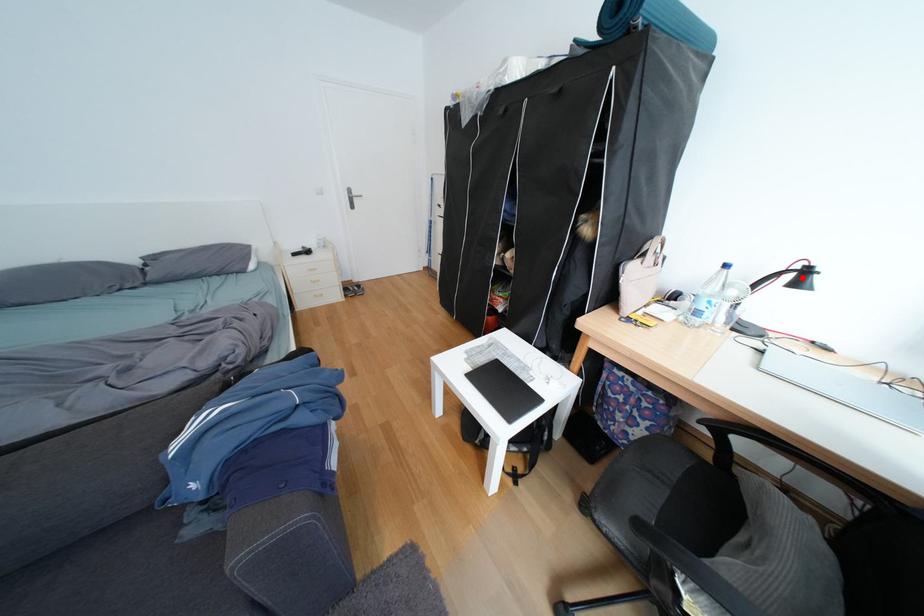
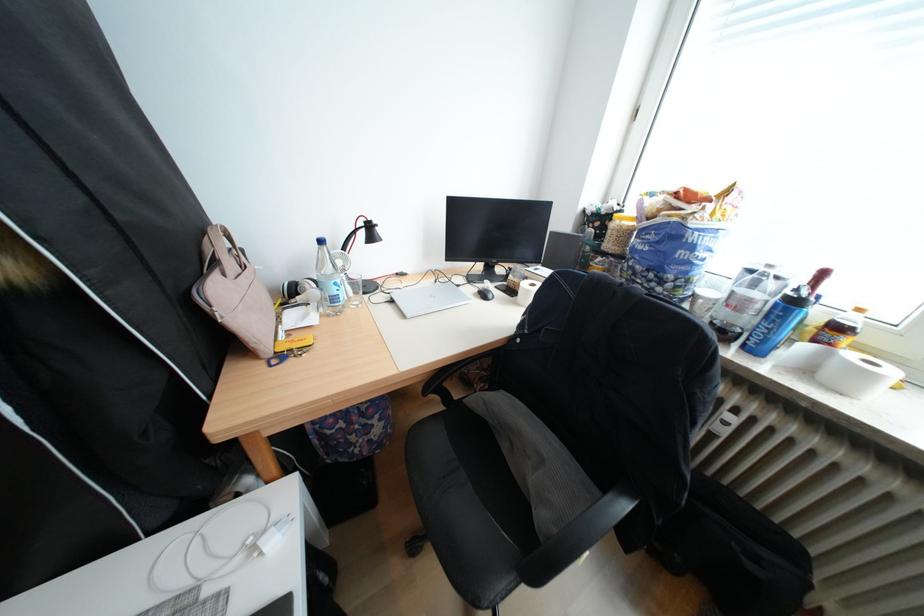
Find the pixel in the second image that matches the highlighted location in the first image.

(374, 235)